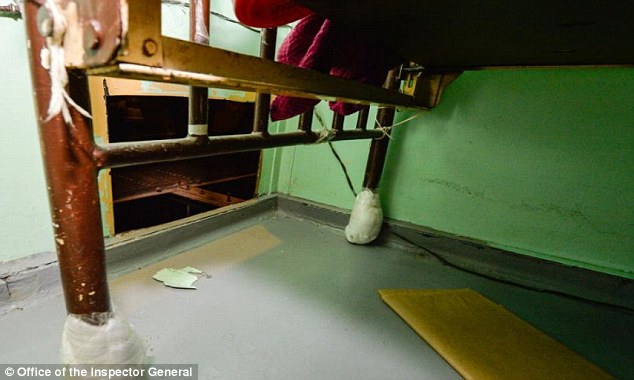
You are a GUI agent. You are given a task and a screenshot of the screen. Output one action in this format:
    pyautogui.click(x=<x>, y=<y>)
    Task: Click on the green wall
    Image resolution: width=634 pixels, height=380 pixels.
    Given the screenshot: What is the action you would take?
    pyautogui.click(x=179, y=166), pyautogui.click(x=376, y=147), pyautogui.click(x=472, y=171)